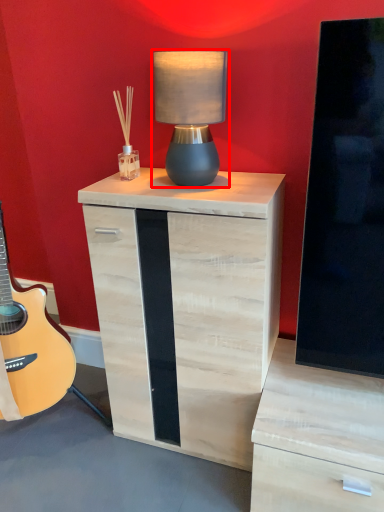
Question: From the image's perspective, where is table lamp (annotated by the red box) located relative to nightstand?

Choices:
 (A) below
 (B) above

Answer: (B)